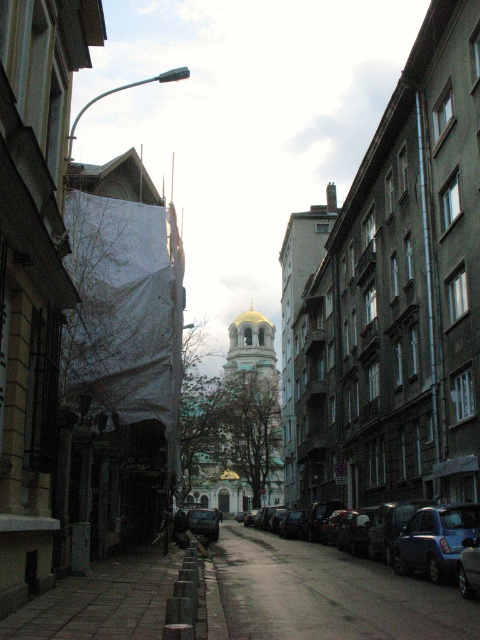
Locate an element on the screen. metallic blue car at center is located at coordinates (420, 538).

Does metallic blue car at center have a greater width compared to shiny black car at center?

Incorrect, metallic blue car at center's width does not surpass shiny black car at center's.

Where is `metallic blue car at center`? The image size is (480, 640). metallic blue car at center is located at coordinates (420, 538).

Describe the element at coordinates (103, 600) in the screenshot. I see `gray concrete pavement at lower center` at that location.

Which is above, gray concrete pavement at lower center or shiny black car at center?

gray concrete pavement at lower center is above.

Does point (57, 593) lie behind point (189, 529)?

No, (57, 593) is in front of (189, 529).

The height and width of the screenshot is (640, 480). I want to click on gray concrete pavement at lower center, so [103, 600].

Is metallic blue car at center bigger than blue metallic car at lower right?

Indeed, metallic blue car at center has a larger size compared to blue metallic car at lower right.

Is metallic blue car at center wider than blue metallic car at lower right?

Yes, metallic blue car at center is wider than blue metallic car at lower right.

Is point (444, 506) closer to camera compared to point (444, 525)?

No, it is not.

Find the location of `metallic blue car at center`. metallic blue car at center is located at coordinates [x=420, y=538].